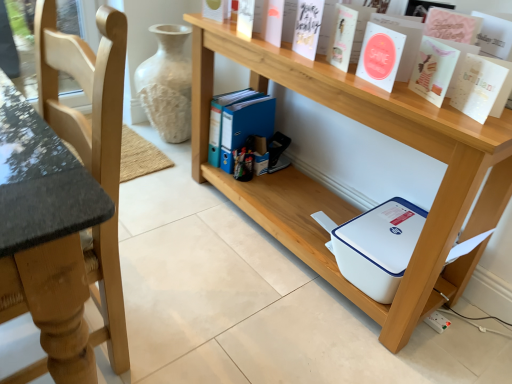
I want to click on vacant space to the left of white plastic printer at lower center, so click(x=180, y=222).